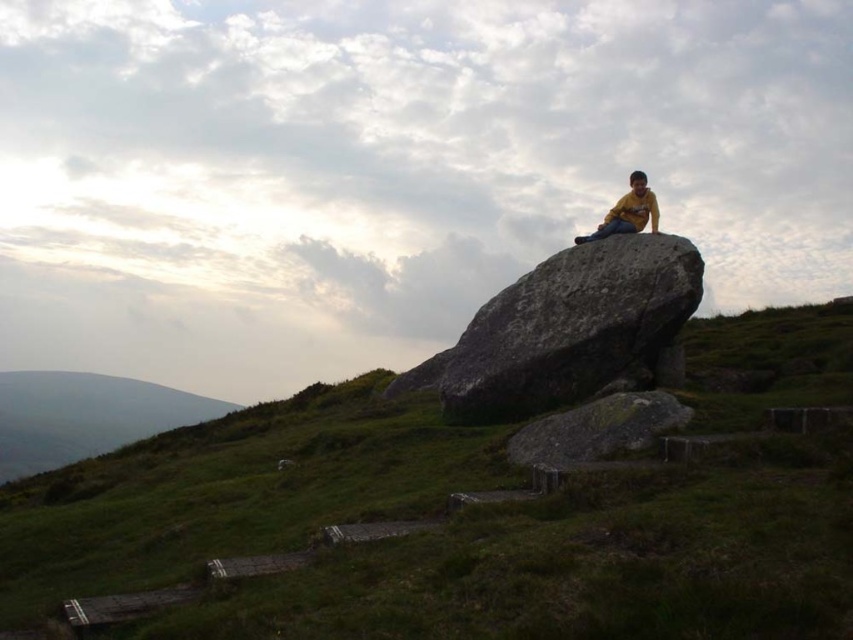
Which is above, gray rough boulder at upper center or yellow matte shirt at upper center?

yellow matte shirt at upper center is above.

Is point (624, 330) in front of point (604, 225)?

Yes, it is in front of point (604, 225).

Is point (486, 362) closer to camera compared to point (630, 173)?

Yes, it is.

Identify the location of gray rough boulder at upper center. This screenshot has width=853, height=640. (566, 328).

Can you confirm if green grassy at upper center is taller than gray rough boulder at upper center?

Correct, green grassy at upper center is much taller as gray rough boulder at upper center.

Does green grassy at upper center have a greater width compared to gray rough boulder at upper center?

Yes, green grassy at upper center is wider than gray rough boulder at upper center.

Is point (801, 449) farther from viewer compared to point (692, 301)?

No, (801, 449) is closer to viewer.

Find the location of `green grassy at upper center`. green grassy at upper center is located at coordinates (434, 532).

This screenshot has width=853, height=640. I want to click on gray rough boulder at upper center, so click(566, 328).

Who is more distant from viewer, (x=564, y=333) or (x=143, y=410)?

Point (x=143, y=410)

Locate an element on the screen. This screenshot has height=640, width=853. gray rough boulder at upper center is located at coordinates (566, 328).